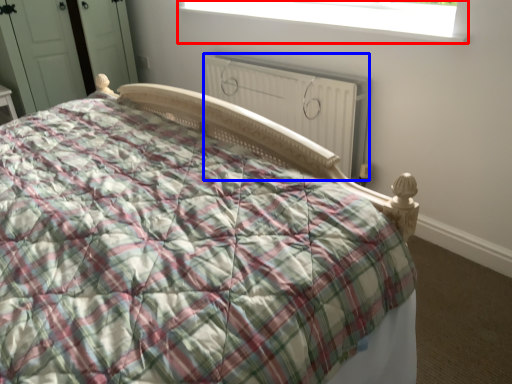
Question: Which point is closer to the camera, window (highlighted by a red box) or radiator (highlighted by a blue box)?

Choices:
 (A) window
 (B) radiator

Answer: (A)